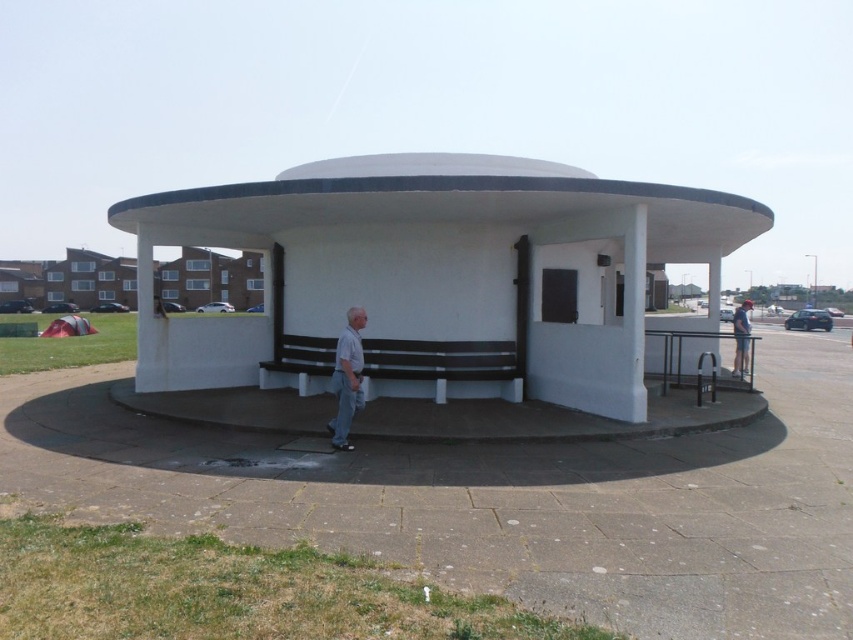
You are planning to set up a picnic and need to decide where to place your blanket. You have a white matte gazebo at center and light blue denim jeans at center in view. Which object takes up more space in the image?

The white matte gazebo at center is bigger than light blue denim jeans at center, so the gazebo takes up more space in the image.

You are standing at point 0.5, 0.5 in the image coordinate system. You want to walk directly to the white matte gazebo at center. What direction should you walk in?

Since the white matte gazebo at center is located at point (437, 275) and you are at (426, 320), you should walk slightly to the left and forward to reach it.